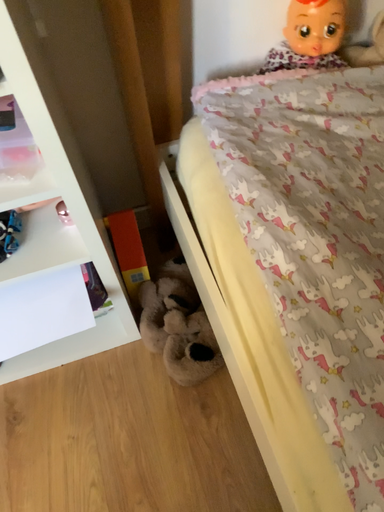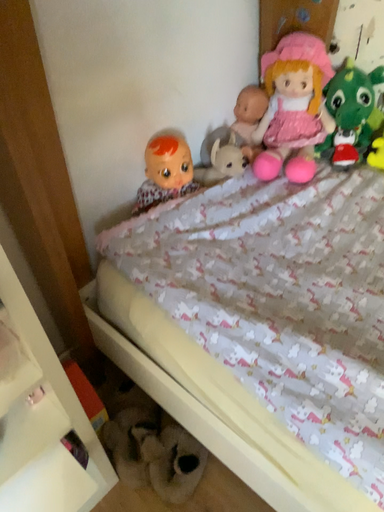
Question: Which way did the camera rotate in the video?

Choices:
 (A) rotated upward
 (B) rotated downward

Answer: (A)